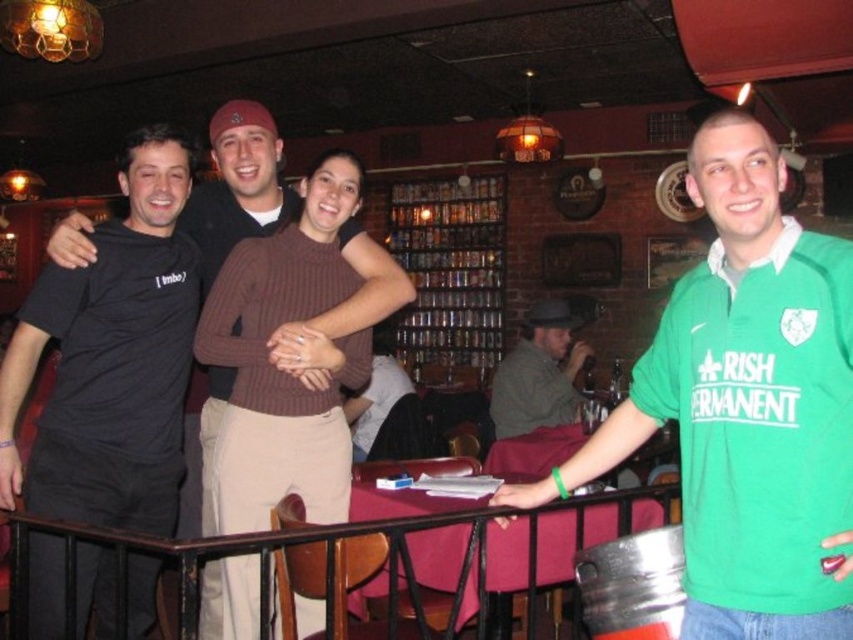
Question: Among these objects, which one is nearest to the camera?

Choices:
 (A) gray wool hat at center
 (B) green jersey at center

Answer: (B)

Question: Does black matte t-shirt at left appear on the left side of black matte t-shirt at center?

Choices:
 (A) yes
 (B) no

Answer: (A)

Question: Can you confirm if black matte t-shirt at center is positioned to the right of gray wool hat at center?

Choices:
 (A) no
 (B) yes

Answer: (A)

Question: Which object appears closest to the camera in this image?

Choices:
 (A) black matte t-shirt at center
 (B) black matte t-shirt at left

Answer: (B)

Question: Is green jersey at center thinner than gray wool hat at center?

Choices:
 (A) yes
 (B) no

Answer: (A)

Question: Which object is the closest to the black matte t-shirt at center?

Choices:
 (A) gray wool hat at center
 (B) green jersey at center
 (C) black metal rail at center

Answer: (C)